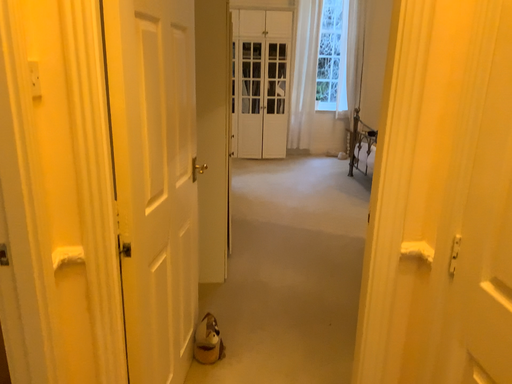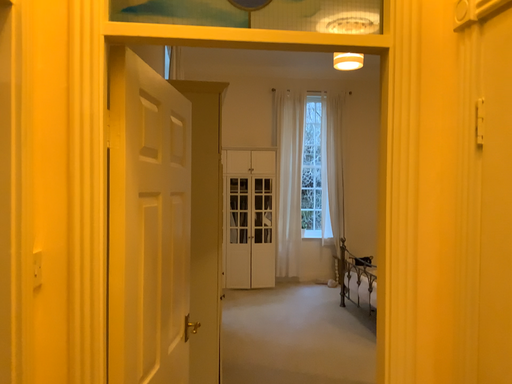
Question: Which way did the camera rotate in the video?

Choices:
 (A) rotated downward
 (B) rotated upward

Answer: (B)